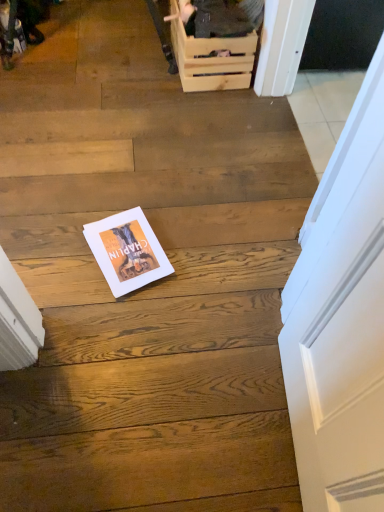
Find the location of a particular element. Image resolution: width=384 pixels, height=512 pixels. vacant space that is to the left of wooden crate at upper center is located at coordinates (124, 54).